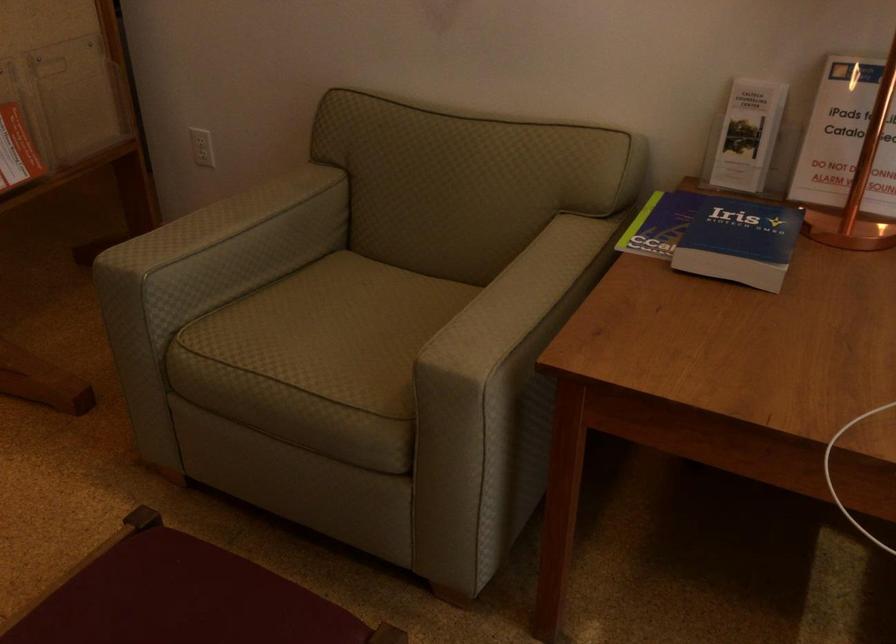
Locate an element on the screen. The height and width of the screenshot is (644, 896). chair sitting surface is located at coordinates (343, 325).